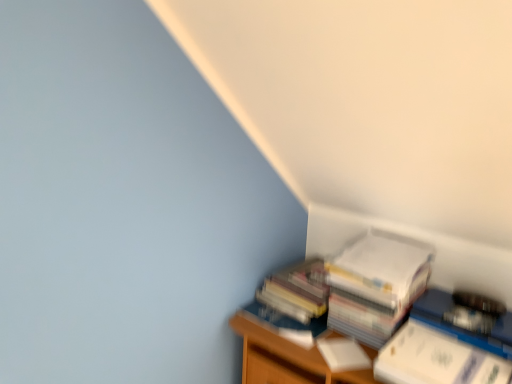
Question: Is white paper stack at lower right in front of or behind white paper at upper right, which is the 3th paperback book from front to back, in the image?

Choices:
 (A) front
 (B) behind

Answer: (B)

Question: From the image's perspective, is white paper stack at lower right positioned above or below white paper at upper right, acting as the first paperback book starting from the back?

Choices:
 (A) above
 (B) below

Answer: (A)

Question: Which object is the closest to the white paper stack at lower right?

Choices:
 (A) white paper at right, the 3th paperback book in the back-to-front sequence
 (B) wooden bookshelf at lower right
 (C) white matte paperback book at lower right, which is the 2th paperback book from back to front
 (D) white paper at upper right, acting as the first paperback book starting from the back

Answer: (B)

Question: Based on their relative distances, which object is nearer to the wooden bookshelf at lower right?

Choices:
 (A) white matte paperback book at lower right, which is the 2th paperback book from back to front
 (B) white paper stack at lower right
 (C) white paper at upper right, which is the 3th paperback book from front to back
 (D) white paper at right, the 3th paperback book in the back-to-front sequence

Answer: (B)